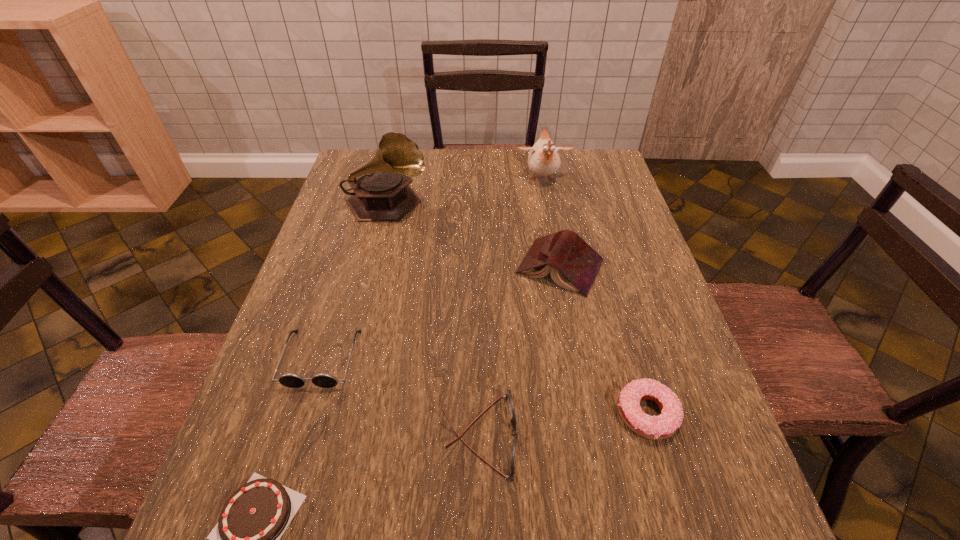
At what (x,y) coordinates should I click in order to perform the action: click on object located in the far left corner section of the desktop. Please return your answer as a coordinate pair (x, y). Image resolution: width=960 pixels, height=540 pixels. Looking at the image, I should click on [382, 193].

I want to click on object that is at the far right corner, so click(x=543, y=160).

You are a GUI agent. You are given a task and a screenshot of the screen. Output one action in this format:
    pyautogui.click(x=<x>, y=<y>)
    Task: Click on the free space at the far edge of the desktop
    
    Given the screenshot: What is the action you would take?
    pyautogui.click(x=452, y=159)

This screenshot has width=960, height=540. I want to click on blank area at the near edge, so click(378, 516).

Where is `free space at the left edge`? This screenshot has width=960, height=540. free space at the left edge is located at coordinates (320, 257).

This screenshot has height=540, width=960. In the image, there is a desktop. In order to click on vacant space at the right edge in this screenshot , I will do `click(577, 198)`.

Identify the location of free space at the far left corner of the desktop. (363, 163).

At what (x,y) coordinates should I click in order to perform the action: click on empty location between the bird and the tallest object. Please return your answer as a coordinate pair (x, y). The height and width of the screenshot is (540, 960). Looking at the image, I should click on (465, 193).

Where is `empty space that is in between the spectacles and the fifth shortest object`? empty space that is in between the spectacles and the fifth shortest object is located at coordinates (519, 351).

You are a GUI agent. You are given a task and a screenshot of the screen. Output one action in this format:
    pyautogui.click(x=<x>, y=<y>)
    Task: Click on the vacant area that lies between the third farthest object and the sunglasses
    The image size is (960, 540).
    Given the screenshot: What is the action you would take?
    pyautogui.click(x=441, y=313)